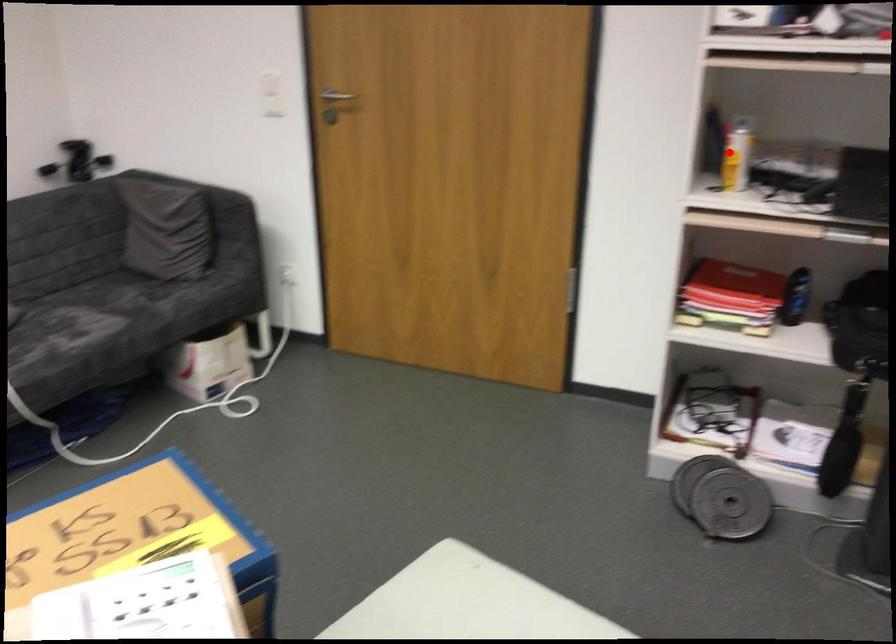
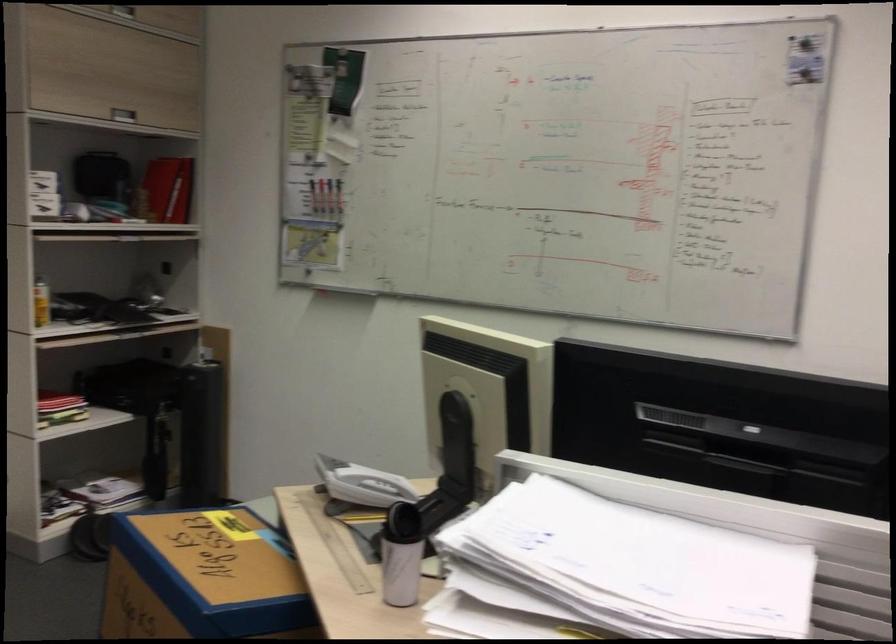
Question: I am providing you with two images of the same scene from different viewpoints. Given a red point in image1, look at the same physical point in image2. Is it:

Choices:
 (A) Closer to the viewpoint
 (B) Farther from the viewpoint

Answer: (B)